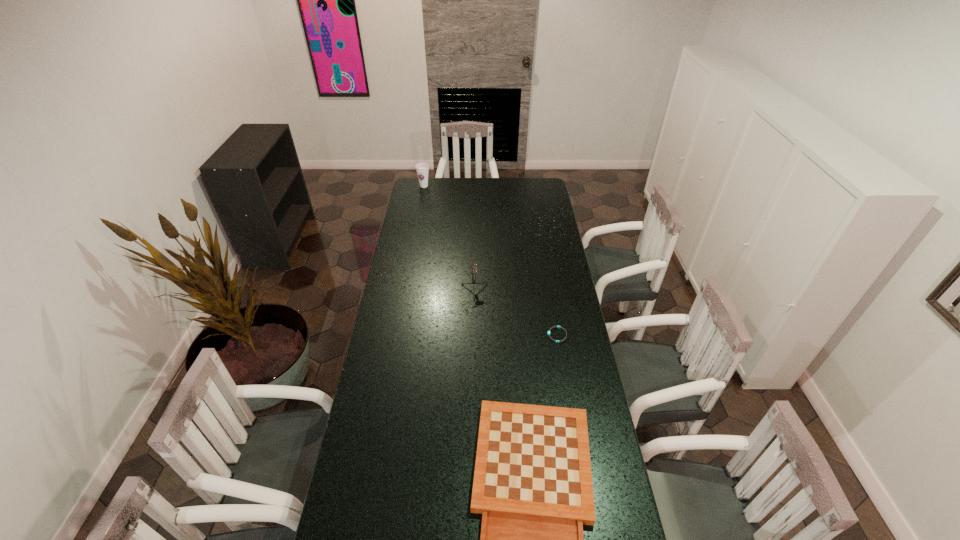
Image resolution: width=960 pixels, height=540 pixels. I want to click on object located in the far edge section of the desktop, so click(x=422, y=169).

Find the location of a particular element. object that is at the left edge is located at coordinates (422, 169).

Find the location of a particular element. object located in the right edge section of the desktop is located at coordinates (557, 341).

Where is `object situated at the far left corner`? The image size is (960, 540). object situated at the far left corner is located at coordinates (422, 169).

What are the coordinates of `vacant space at the far edge of the desktop` in the screenshot? It's located at click(x=444, y=178).

This screenshot has height=540, width=960. In order to click on vacant space at the left edge of the desktop in this screenshot , I will do [355, 466].

The height and width of the screenshot is (540, 960). What are the coordinates of `blank area at the right edge` in the screenshot? It's located at (563, 303).

This screenshot has height=540, width=960. In the image, there is a desktop. Find the location of `free region at the far left corner`. free region at the far left corner is located at coordinates (420, 188).

At what (x,y) coordinates should I click in order to perform the action: click on free space between the microphone and the shortest object. Please return your answer as a coordinate pair (x, y). Looking at the image, I should click on pyautogui.click(x=515, y=317).

Identify the location of free space between the farthest object and the microphone. (448, 242).